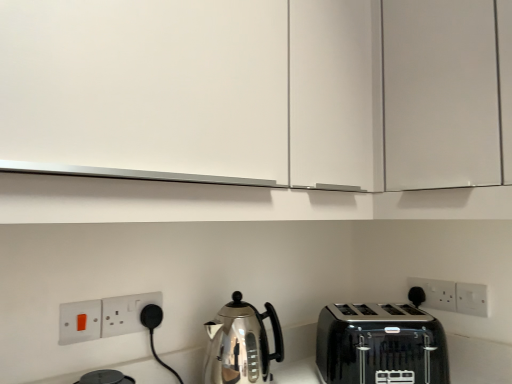
Question: Is white matte cabinet at upper center far from white plastic electric outlet at right, which is the 2th electric outlet from back to front?

Choices:
 (A) yes
 (B) no

Answer: (B)

Question: Can you confirm if white matte cabinet at upper center is positioned to the right of white plastic electric outlet at right, which is the 2th electric outlet from back to front?

Choices:
 (A) yes
 (B) no

Answer: (B)

Question: Does white matte cabinet at upper center have a lesser width compared to white plastic electric outlet at right, which appears as the 3th electric outlet when viewed from the front?

Choices:
 (A) no
 (B) yes

Answer: (A)

Question: Would you say white plastic electric outlet at right, which is counted as the first electric outlet, starting from the right, is part of white matte cabinet at upper center's contents?

Choices:
 (A) no
 (B) yes

Answer: (A)

Question: Considering the relative sizes of white matte cabinet at upper center and white plastic electric outlet at right, which is counted as the first electric outlet, starting from the right, in the image provided, is white matte cabinet at upper center taller than white plastic electric outlet at right, which is counted as the first electric outlet, starting from the right,?

Choices:
 (A) no
 (B) yes

Answer: (B)

Question: From the image's perspective, is white matte cabinet at upper center over white plastic electric outlet at right, which is counted as the first electric outlet, starting from the right?

Choices:
 (A) yes
 (B) no

Answer: (A)

Question: Is white plastic electrical outlet at lower right, which ranks as the second electric outlet in right-to-left order, to the left of white matte cabinet at upper center from the viewer's perspective?

Choices:
 (A) yes
 (B) no

Answer: (B)

Question: Can you confirm if white plastic electrical outlet at lower right, the first electric outlet when ordered from back to front, is positioned to the right of white matte cabinet at upper center?

Choices:
 (A) yes
 (B) no

Answer: (A)

Question: Is white plastic electrical outlet at lower right, which appears as the 4th electric outlet when viewed from the front, looking in the opposite direction of white matte cabinet at upper center?

Choices:
 (A) yes
 (B) no

Answer: (B)

Question: From the image's perspective, does white plastic electrical outlet at lower right, which ranks as the second electric outlet in right-to-left order, appear higher than white matte cabinet at upper center?

Choices:
 (A) no
 (B) yes

Answer: (A)

Question: From the image's perspective, would you say white plastic electrical outlet at lower right, which ranks as the second electric outlet in right-to-left order, is shown under white matte cabinet at upper center?

Choices:
 (A) no
 (B) yes

Answer: (B)

Question: From a real-world perspective, is white plastic electrical outlet at lower right, which appears as the 4th electric outlet when viewed from the front, on top of white matte cabinet at upper center?

Choices:
 (A) no
 (B) yes

Answer: (A)

Question: Can you confirm if matte white switch at lower left, marked as the first electric outlet in a front-to-back arrangement, is thinner than white matte cabinet at upper center?

Choices:
 (A) no
 (B) yes

Answer: (B)